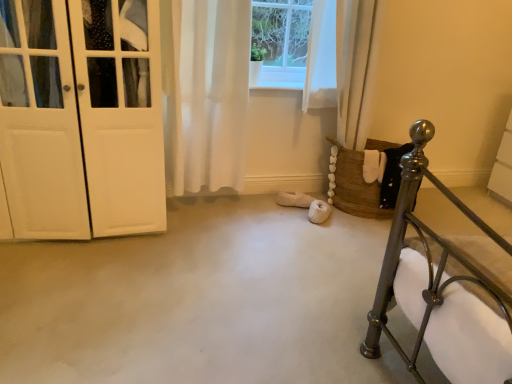
The width and height of the screenshot is (512, 384). What are the coordinates of `free point to the right of white matte door at left` in the screenshot? It's located at 217,257.